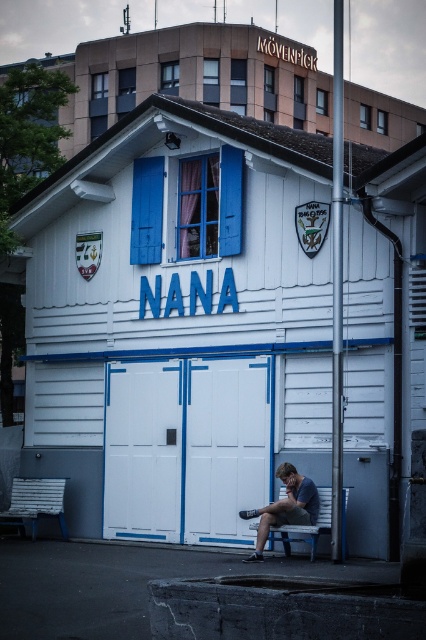
Question: Which point appears farthest from the camera in this image?

Choices:
 (A) (126, 250)
 (B) (16, 483)

Answer: (B)

Question: Does white wooden shed at center appear on the right side of white painted wood garage door at center?

Choices:
 (A) yes
 (B) no

Answer: (A)

Question: Which object appears closest to the camera in this image?

Choices:
 (A) blue wooden bench at lower center
 (B) white wooden shed at center
 (C) wooden park bench at lower left

Answer: (B)

Question: Can you confirm if white wooden shed at center is smaller than white painted wood garage door at center?

Choices:
 (A) no
 (B) yes

Answer: (A)

Question: Does white wooden shed at center have a smaller size compared to white painted wood garage door at center?

Choices:
 (A) yes
 (B) no

Answer: (B)

Question: Based on their relative distances, which object is farther from the white wooden shed at center?

Choices:
 (A) wooden park bench at lower left
 (B) white painted wood garage door at center

Answer: (A)